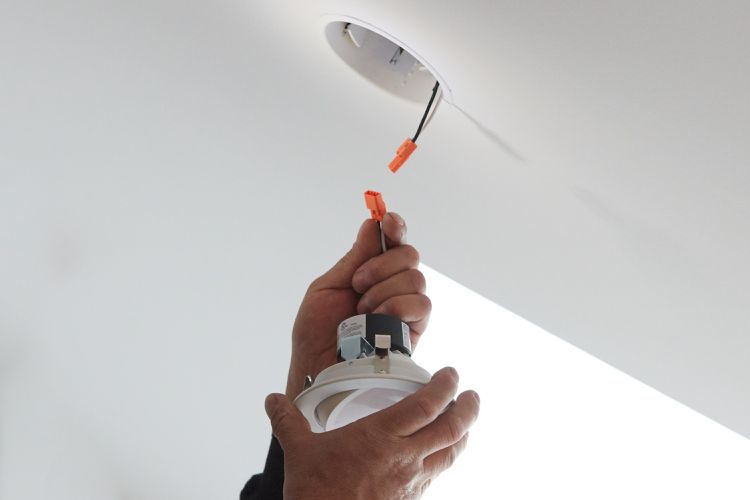
Locate an element on the screen. This screenshot has width=750, height=500. socket is located at coordinates (376, 50).